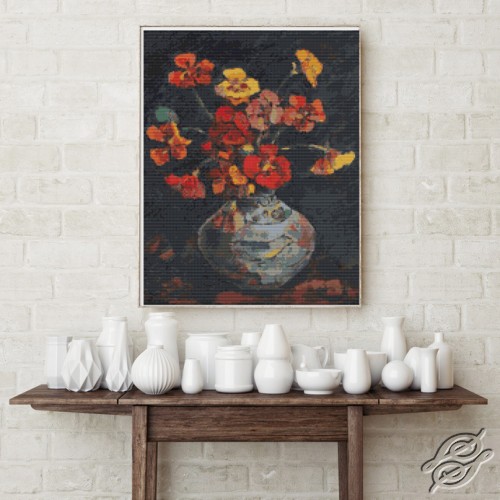
Locate an element on the screen. This screenshot has width=500, height=500. bowl is located at coordinates (313, 382).